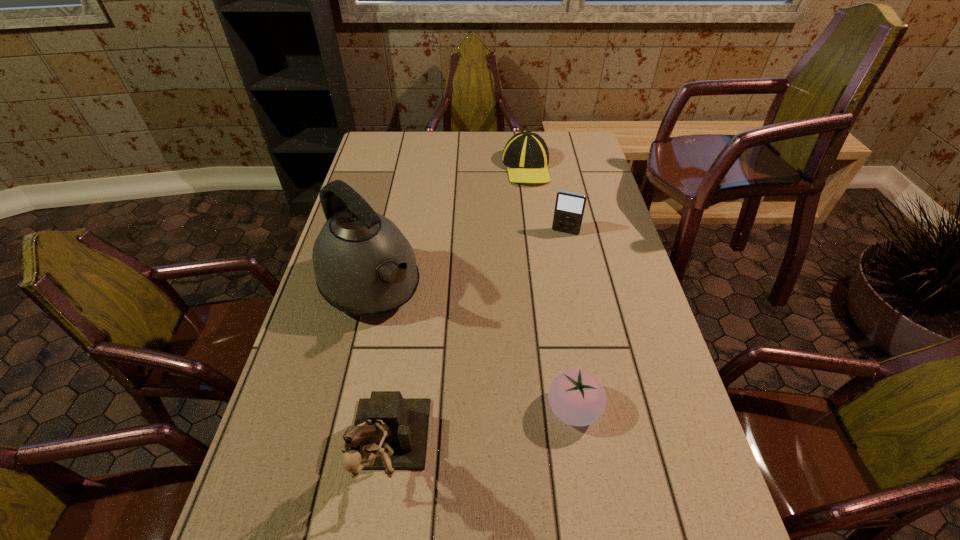
Where is `free space located 0.180m with the brim of the farthest object facing forward`? The height and width of the screenshot is (540, 960). free space located 0.180m with the brim of the farthest object facing forward is located at coordinates (520, 218).

Find the location of a particular element. The width and height of the screenshot is (960, 540). free location located 0.290m with the brim of the farthest object facing forward is located at coordinates (516, 240).

Find the location of a particular element. This screenshot has height=540, width=960. free space located 0.180m with the brim of the farthest object facing forward is located at coordinates (520, 218).

The image size is (960, 540). I want to click on blank space located 0.190m at the spout of the kettle, so click(444, 365).

Where is `free space located 0.240m at the spout of the kettle`? The width and height of the screenshot is (960, 540). free space located 0.240m at the spout of the kettle is located at coordinates (457, 379).

Find the location of a particular element. This screenshot has height=540, width=960. free region located at the spout of the kettle is located at coordinates (457, 379).

Identify the location of object positioned at the far edge. (526, 156).

The width and height of the screenshot is (960, 540). Identify the location of object that is at the near edge. (390, 432).

Locate an element on the screen. This screenshot has width=960, height=540. object at the left edge is located at coordinates (363, 264).

The width and height of the screenshot is (960, 540). Find the location of `object situated at the right edge`. object situated at the right edge is located at coordinates (569, 208).